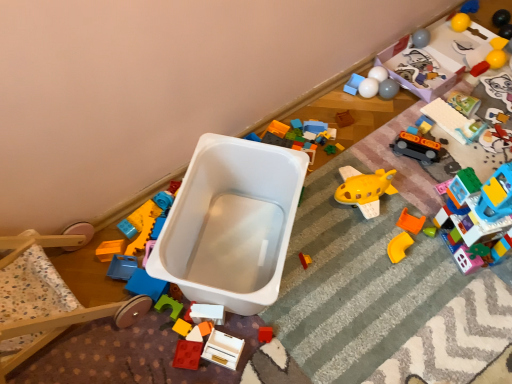
Locate an element on the screen. Image resolution: width=512 pixels, height=384 pixels. spots to the right of rubberized plastic block at center, the sixteenth toy from the right is located at coordinates (245, 332).